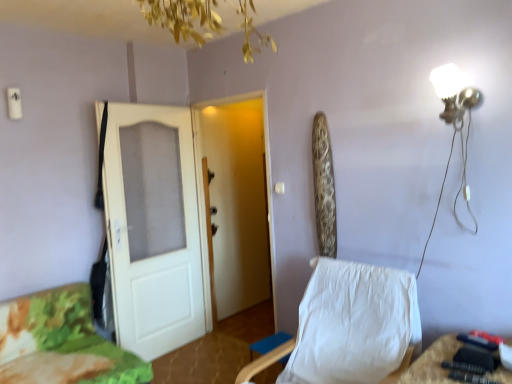
Question: Is camouflage fabric bed at lower left wider than white matte door at left, arranged as the 2th door when viewed from the right?

Choices:
 (A) yes
 (B) no

Answer: (A)

Question: From the image's perspective, is camouflage fabric bed at lower left located above white matte door at left, arranged as the 2th door when viewed from the right?

Choices:
 (A) no
 (B) yes

Answer: (A)

Question: Is camouflage fabric bed at lower left positioned before white matte door at left, which appears as the 1th door when viewed from the left?

Choices:
 (A) yes
 (B) no

Answer: (A)

Question: Can you confirm if camouflage fabric bed at lower left is smaller than white matte door at left, which appears as the 1th door when viewed from the left?

Choices:
 (A) yes
 (B) no

Answer: (B)

Question: Is white matte door at left, which appears as the 1th door when viewed from the left, at the back of camouflage fabric bed at lower left?

Choices:
 (A) no
 (B) yes

Answer: (A)

Question: Is camouflage fabric bed at lower left placed right next to white matte door at left, arranged as the 2th door when viewed from the right?

Choices:
 (A) yes
 (B) no

Answer: (B)

Question: Can you confirm if white matte door at left, arranged as the 2th door when viewed from the right, is bigger than white wooden door at center, arranged as the 2th door when viewed from the left?

Choices:
 (A) no
 (B) yes

Answer: (A)

Question: Is the position of white matte door at left, arranged as the 2th door when viewed from the right, less distant than that of white wooden door at center, arranged as the 2th door when viewed from the left?

Choices:
 (A) yes
 (B) no

Answer: (A)

Question: Can you confirm if white matte door at left, arranged as the 2th door when viewed from the right, is positioned to the left of white wooden door at center, the 1th door positioned from the right?

Choices:
 (A) yes
 (B) no

Answer: (A)

Question: From the image's perspective, would you say white matte door at left, arranged as the 2th door when viewed from the right, is shown under white wooden door at center, the 1th door positioned from the right?

Choices:
 (A) yes
 (B) no

Answer: (A)

Question: From a real-world perspective, is white matte door at left, which appears as the 1th door when viewed from the left, positioned over white wooden door at center, arranged as the 2th door when viewed from the left, based on gravity?

Choices:
 (A) no
 (B) yes

Answer: (A)

Question: From a real-world perspective, is white matte door at left, arranged as the 2th door when viewed from the right, positioned over white fabric chair at center based on gravity?

Choices:
 (A) no
 (B) yes

Answer: (B)